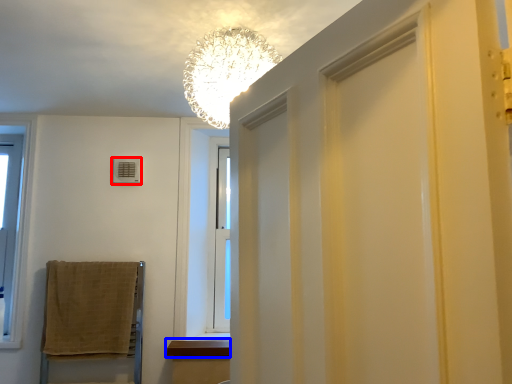
Question: Which point is closer to the camera, air conditioner (highlighted by a red box) or window sill (highlighted by a blue box)?

Choices:
 (A) air conditioner
 (B) window sill

Answer: (B)